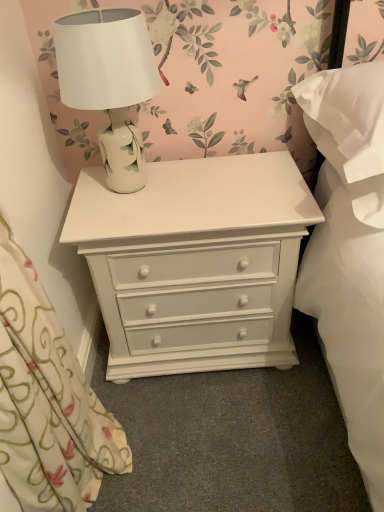
Question: Is white soft pillow at right smaller than floral fabric curtain at left?

Choices:
 (A) no
 (B) yes

Answer: (B)

Question: Is the depth of white soft pillow at right greater than that of floral fabric curtain at left?

Choices:
 (A) yes
 (B) no

Answer: (A)

Question: Can you confirm if white soft pillow at right is taller than floral fabric curtain at left?

Choices:
 (A) yes
 (B) no

Answer: (B)

Question: From a real-world perspective, is white soft pillow at right located higher than floral fabric curtain at left?

Choices:
 (A) no
 (B) yes

Answer: (B)

Question: From the image's perspective, is white soft pillow at right above floral fabric curtain at left?

Choices:
 (A) yes
 (B) no

Answer: (A)

Question: Considering the relative sizes of white soft pillow at right and floral fabric curtain at left in the image provided, is white soft pillow at right wider than floral fabric curtain at left?

Choices:
 (A) no
 (B) yes

Answer: (B)

Question: Can you confirm if white soft pillow at right is positioned to the right of white painted wood chest of drawers at center?

Choices:
 (A) yes
 (B) no

Answer: (A)

Question: Is white soft pillow at right positioned beyond the bounds of white painted wood chest of drawers at center?

Choices:
 (A) yes
 (B) no

Answer: (A)

Question: Does white soft pillow at right appear on the left side of white painted wood chest of drawers at center?

Choices:
 (A) no
 (B) yes

Answer: (A)

Question: From a real-world perspective, is white soft pillow at right physically below white painted wood chest of drawers at center?

Choices:
 (A) no
 (B) yes

Answer: (A)

Question: Can you confirm if white soft pillow at right is smaller than white painted wood chest of drawers at center?

Choices:
 (A) yes
 (B) no

Answer: (A)

Question: Does white soft pillow at right have a lesser width compared to white painted wood chest of drawers at center?

Choices:
 (A) no
 (B) yes

Answer: (A)

Question: Would you say white soft pillow at right is part of white ceramic lamp at upper center's contents?

Choices:
 (A) no
 (B) yes

Answer: (A)